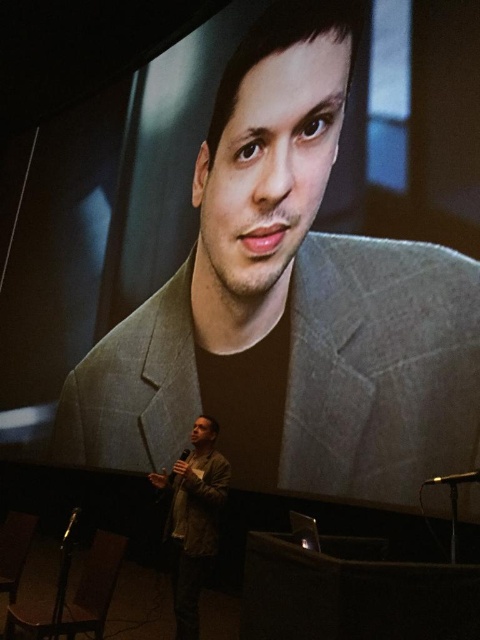
Between point (394, 246) and point (191, 449), which one is positioned behind?

The point (191, 449) is behind.

Is point (373, 291) closer to camera compared to point (189, 486)?

No, it is not.

I want to click on gray checkered suit at center, so click(380, 369).